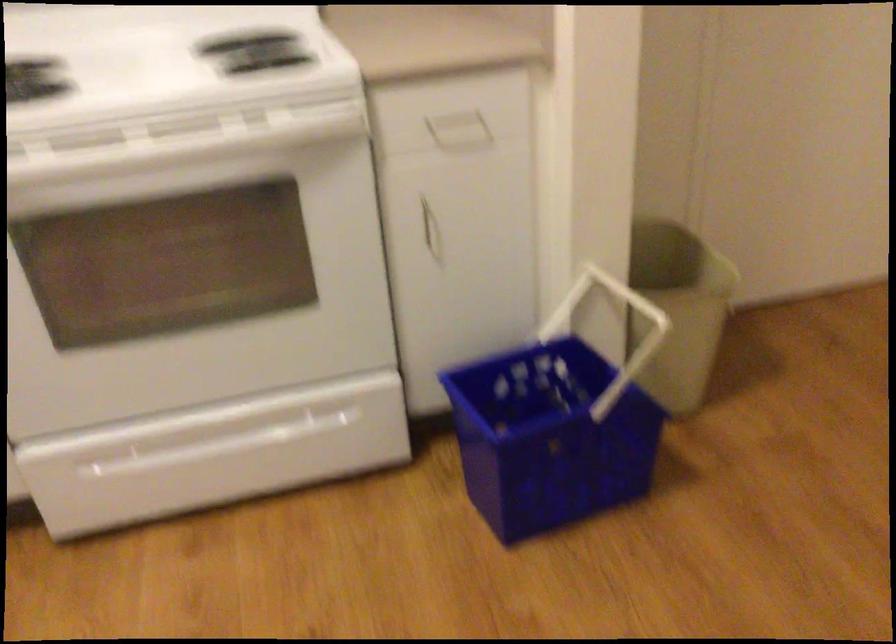
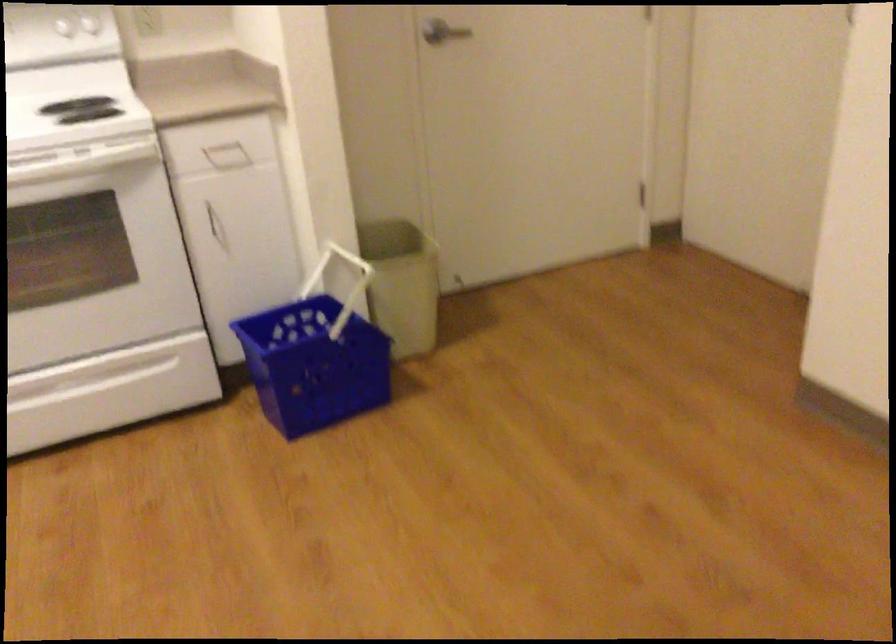
Find the pixel in the second image that matches point (588, 307) in the first image.

(337, 272)